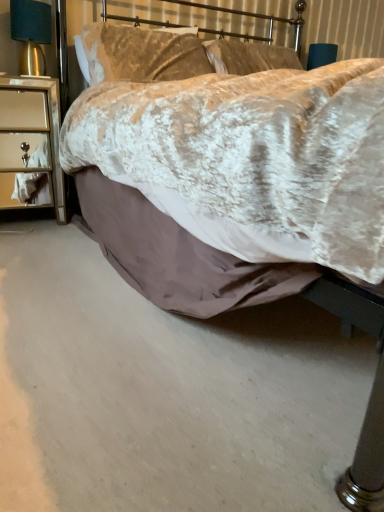
Question: Is silver mirrored nightstand at left bigger than satin gold lampshade at left?

Choices:
 (A) no
 (B) yes

Answer: (B)

Question: Are silver mirrored nightstand at left and satin gold lampshade at left far apart?

Choices:
 (A) yes
 (B) no

Answer: (B)

Question: Considering the relative sizes of silver mirrored nightstand at left and satin gold lampshade at left in the image provided, is silver mirrored nightstand at left wider than satin gold lampshade at left?

Choices:
 (A) no
 (B) yes

Answer: (B)

Question: Is the position of silver mirrored nightstand at left less distant than that of satin gold lampshade at left?

Choices:
 (A) no
 (B) yes

Answer: (B)

Question: Considering the relative sizes of silver mirrored nightstand at left and satin gold lampshade at left in the image provided, is silver mirrored nightstand at left shorter than satin gold lampshade at left?

Choices:
 (A) yes
 (B) no

Answer: (B)

Question: From a real-world perspective, is silver mirrored nightstand at left positioned over satin gold lampshade at left based on gravity?

Choices:
 (A) yes
 (B) no

Answer: (B)

Question: Is silver mirrored nightstand at left to the left of velvet beige pillow at upper center from the viewer's perspective?

Choices:
 (A) yes
 (B) no

Answer: (A)

Question: Is silver mirrored nightstand at left shorter than velvet beige pillow at upper center?

Choices:
 (A) yes
 (B) no

Answer: (B)

Question: Does silver mirrored nightstand at left come behind velvet beige pillow at upper center?

Choices:
 (A) no
 (B) yes

Answer: (A)

Question: Is silver mirrored nightstand at left aimed at velvet beige pillow at upper center?

Choices:
 (A) no
 (B) yes

Answer: (A)

Question: Is silver mirrored nightstand at left closer to the viewer compared to velvet beige pillow at upper center?

Choices:
 (A) no
 (B) yes

Answer: (B)

Question: Can you confirm if silver mirrored nightstand at left is thinner than velvet beige pillow at upper center?

Choices:
 (A) no
 (B) yes

Answer: (A)

Question: Does velvet beige pillow at upper center have a lesser height compared to silver mirrored nightstand at left?

Choices:
 (A) no
 (B) yes

Answer: (B)